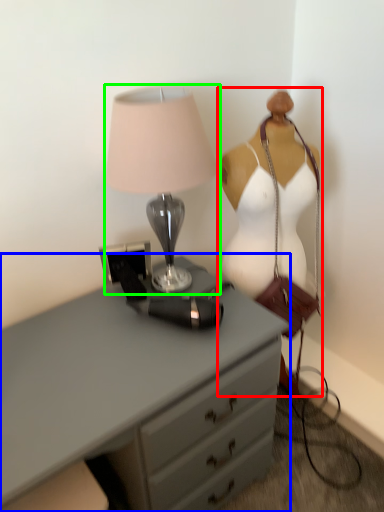
Question: Based on their relative distances, which object is farther from mannequin (highlighted by a red box)? Choose from chest of drawers (highlighted by a blue box) and lamp (highlighted by a green box).

Choices:
 (A) chest of drawers
 (B) lamp

Answer: (A)